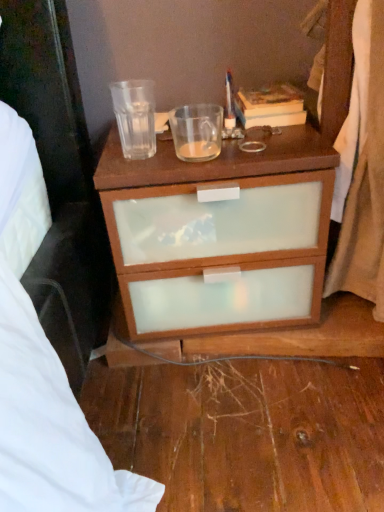
The image size is (384, 512). I want to click on vacant point to the right of translucent glass coffee cup at upper center, marked as the second coffee cup in a left-to-right arrangement, so click(x=258, y=133).